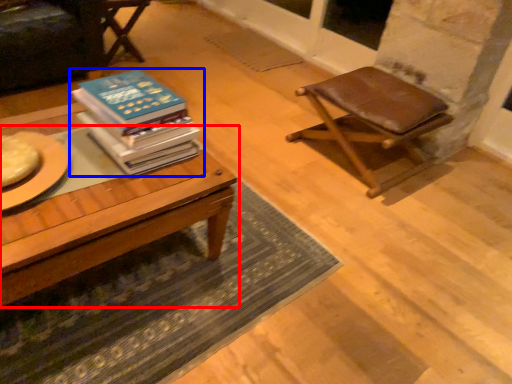
Question: Which point is closer to the camera, table (highlighted by a red box) or book (highlighted by a blue box)?

Choices:
 (A) table
 (B) book

Answer: (A)